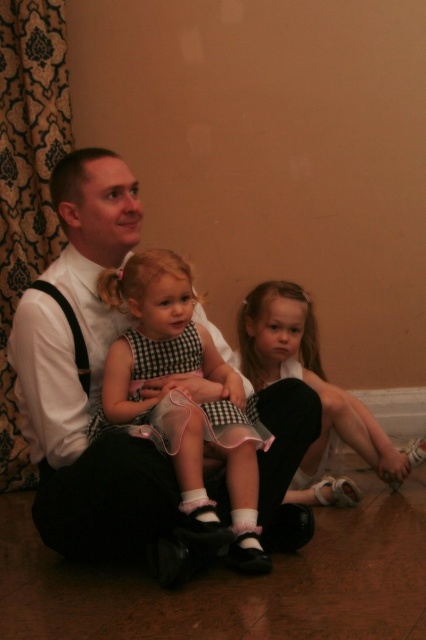
Question: Which object is farther from the camera taking this photo?

Choices:
 (A) matte black dress at center
 (B) checkered fabric dress at center

Answer: (A)

Question: Observing the image, what is the correct spatial positioning of white shirt at center in reference to checkered fabric dress at center?

Choices:
 (A) below
 (B) above

Answer: (B)

Question: Which point is closer to the camera?

Choices:
 (A) (150, 388)
 (B) (210, 435)

Answer: (B)

Question: Which object appears farthest from the camera in this image?

Choices:
 (A) white shirt at center
 (B) checkered fabric dress at center

Answer: (B)

Question: Is white shirt at center above checkered fabric dress at center?

Choices:
 (A) no
 (B) yes

Answer: (B)

Question: Can you confirm if white shirt at center is bigger than matte black dress at center?

Choices:
 (A) yes
 (B) no

Answer: (A)